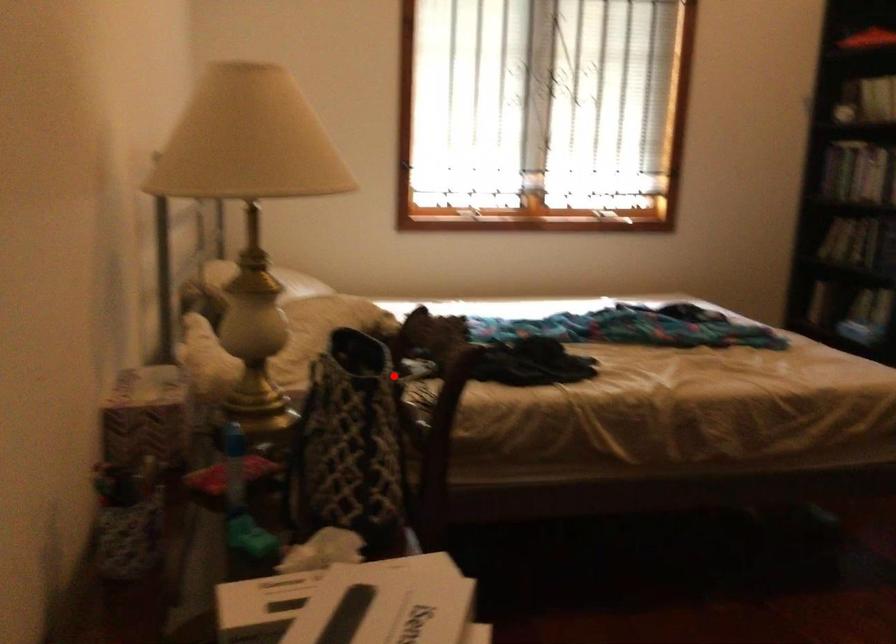
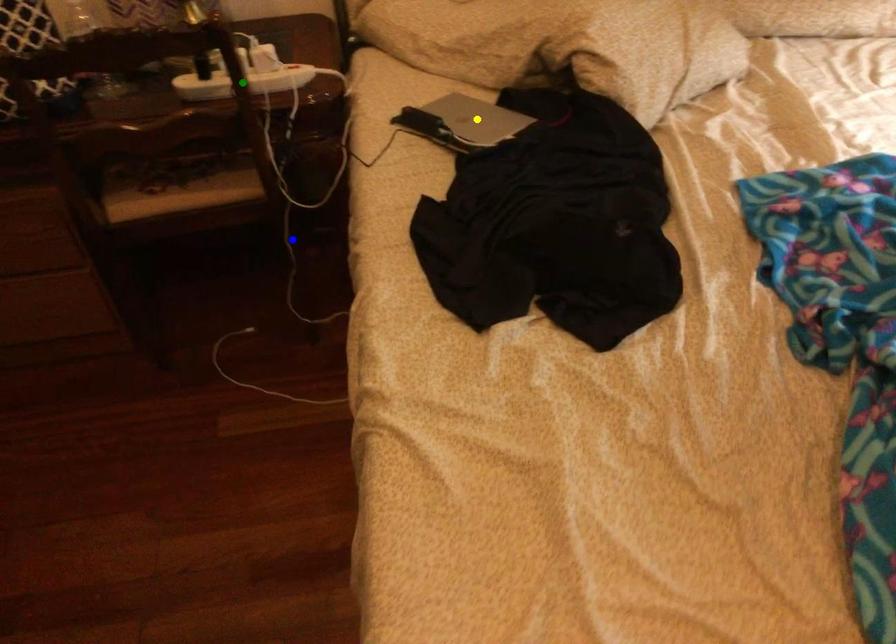
Question: I am providing you with two images of the same scene from different viewpoints. A red point is marked on the first image. You are given multiple points on the second image. Which spot in image 2 lines up with the point in image 1?

Choices:
 (A) yellow point
 (B) green point
 (C) blue point

Answer: (B)